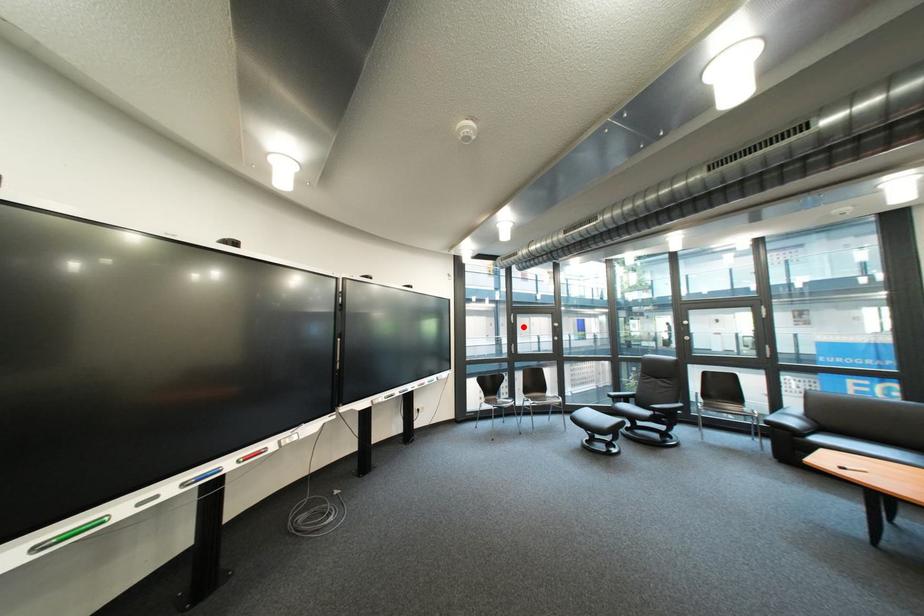
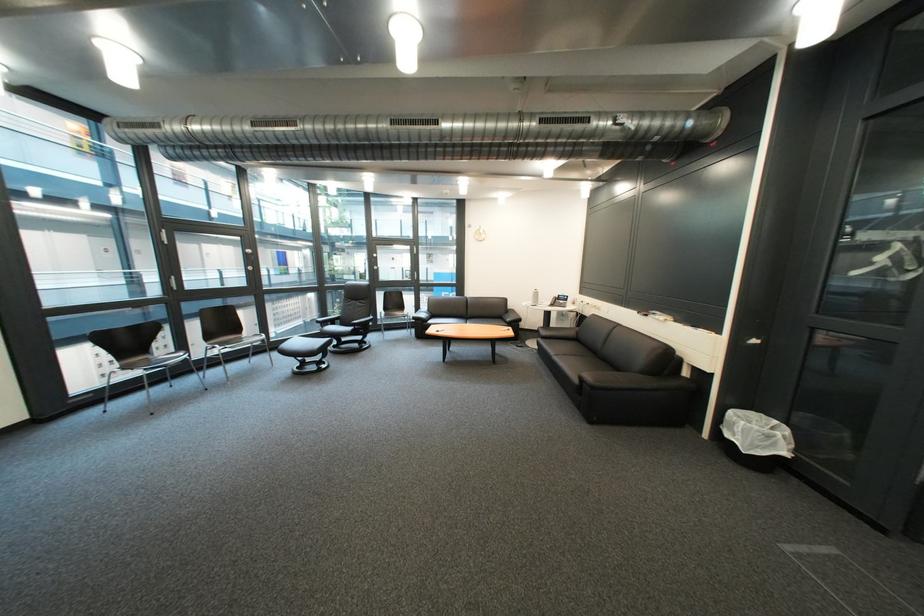
Locate, in the second image, the point that corresponds to the highlighted location in the first image.

(176, 249)